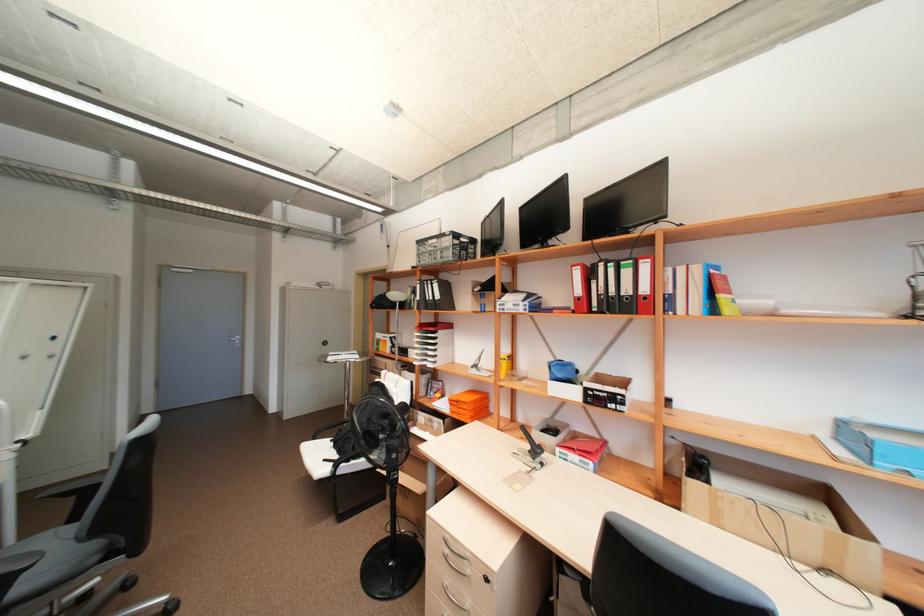
What do you see at coordinates (454, 564) in the screenshot? The image size is (924, 616). I see `a metal cabinet handle` at bounding box center [454, 564].